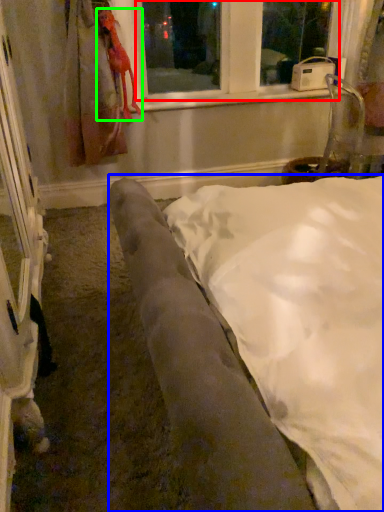
Question: Which object is positioned farthest from bay window (highlighted by a red box)? Select from furniture (highlighted by a blue box) and animal (highlighted by a green box).

Choices:
 (A) furniture
 (B) animal

Answer: (A)